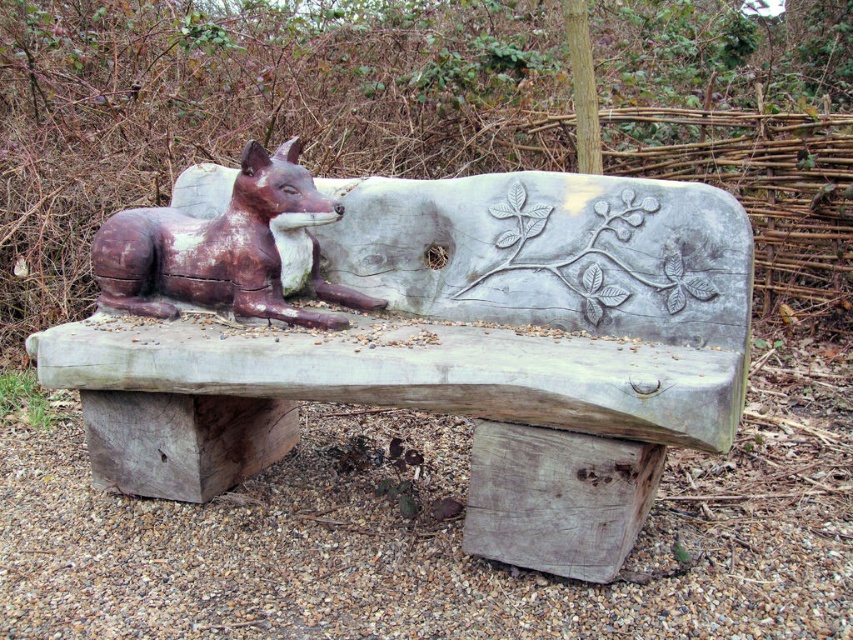
You are a painter who wants to paint the wooden bench with carved fox at center and the rustic wooden fox at center. Which object should you paint first if you want to paint the one that is above the other?

You should paint the rustic wooden fox at center first because the wooden bench with carved fox at center is positioned under it, meaning the rustic wooden fox at center is above and would need to be painted first to avoid obscuring the bench below.

In the scene shown: You are standing at the origin point in the garden. Where is the wooden bench with carved fox at center located?

The wooden bench with carved fox at center is located at point (451, 349).

You are standing in a garden and see the wooden bench with carved fox at center and the rustic wooden fox at center. Which object is closer to you?

The wooden bench with carved fox at center is closer to the viewer than the rustic wooden fox at center.